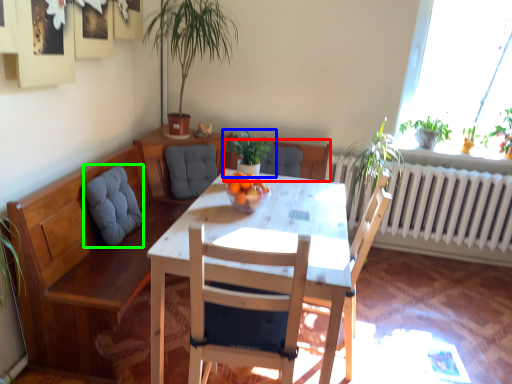
Question: Which is nearer to the chair (highlighted by a red box)? houseplant (highlighted by a blue box) or swivel chair (highlighted by a green box).

Choices:
 (A) houseplant
 (B) swivel chair

Answer: (A)